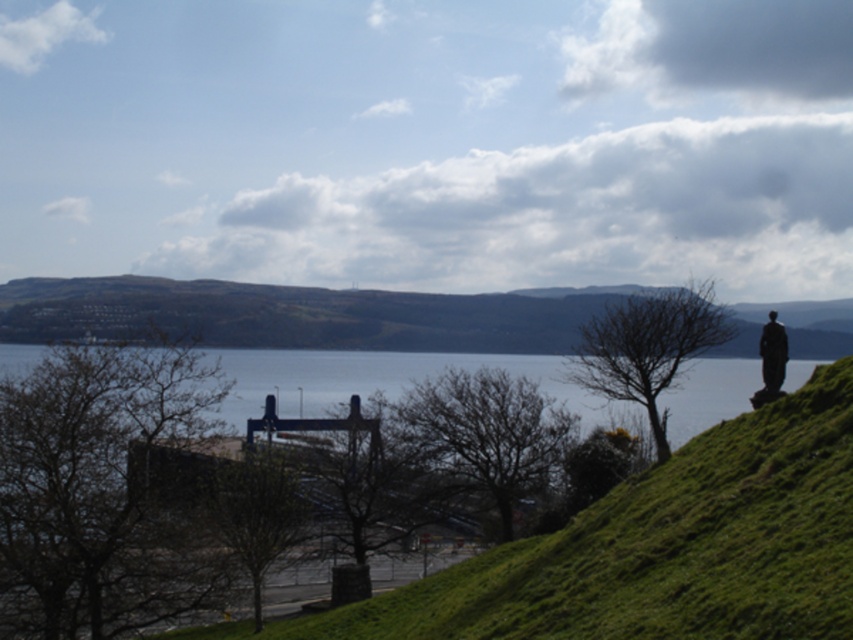
Question: Where is bare branches at center located in relation to dark gray statue at right in the image?

Choices:
 (A) above
 (B) below

Answer: (B)

Question: Is bare branches at center behind green leafy tree at center?

Choices:
 (A) no
 (B) yes

Answer: (B)

Question: Which is nearer to the bare wood tree at center?

Choices:
 (A) brown leafless tree at left
 (B) green leafy tree at center

Answer: (B)

Question: Which point is farther to the camera?

Choices:
 (A) (181, 436)
 (B) (659, 292)

Answer: (B)

Question: Which of the following is the closest to the observer?

Choices:
 (A) brown leafless tree at left
 (B) green leafy tree at center
 (C) bare wood tree at center

Answer: (A)

Question: Can you confirm if brown leafless tree at left is thinner than bare branches at center?

Choices:
 (A) no
 (B) yes

Answer: (B)